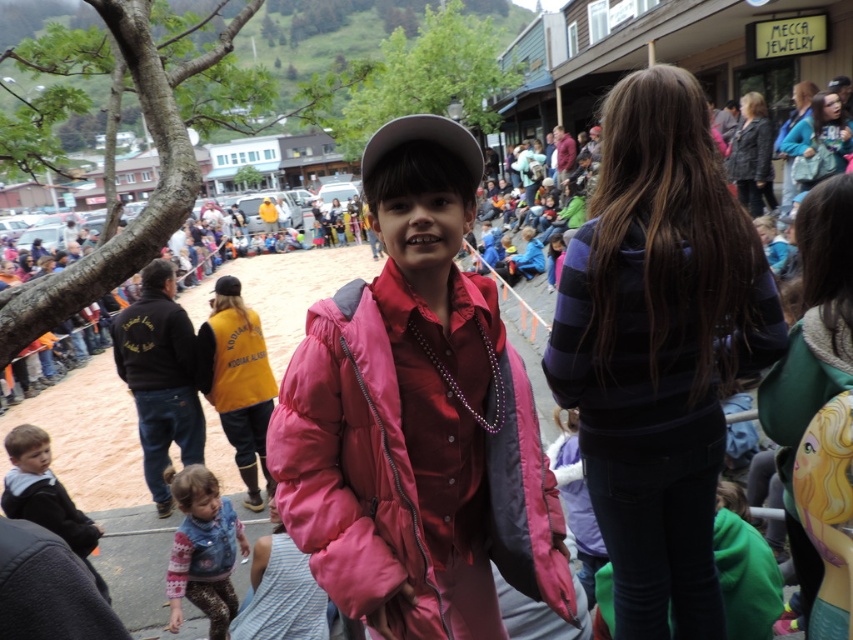
Is pink puffy jacket at center in front of gray matte baseball cap at center?

Yes, pink puffy jacket at center is closer to the viewer.

Between pink puffy jacket at center and gray matte baseball cap at center, which one has less height?

gray matte baseball cap at center

Where is `pink puffy jacket at center`? pink puffy jacket at center is located at coordinates (354, 465).

From the picture: Which of these two, yellow fabric vest at lower left or gray matte baseball cap at center, stands shorter?

gray matte baseball cap at center

Locate an element on the screen. Image resolution: width=853 pixels, height=640 pixels. yellow fabric vest at lower left is located at coordinates (236, 380).

Which is behind, point (218, 362) or point (363, 172)?

The point (218, 362) is behind.

Identify the location of yellow fabric vest at lower left. This screenshot has width=853, height=640. (236, 380).

Who is more forward, (376,321) or (256,358)?

Point (376,321) is more forward.

Is pink puffy jacket at center closer to camera compared to yellow fabric vest at lower left?

Yes, it is in front of yellow fabric vest at lower left.

Describe the element at coordinates (354, 465) in the screenshot. The width and height of the screenshot is (853, 640). I see `pink puffy jacket at center` at that location.

This screenshot has height=640, width=853. In order to click on pink puffy jacket at center in this screenshot , I will do `click(354, 465)`.